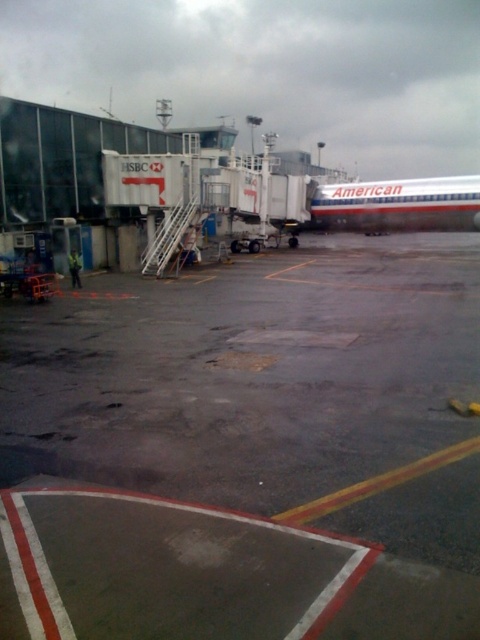
Question: Which point is closer to the camera?

Choices:
 (A) white metallic airplane at center
 (B) wet asphalt tarmac at center

Answer: (B)

Question: Is wet asphalt tarmac at center to the right of white metallic airplane at center from the viewer's perspective?

Choices:
 (A) yes
 (B) no

Answer: (B)

Question: Where is wet asphalt tarmac at center located in relation to white metallic airplane at center in the image?

Choices:
 (A) above
 (B) below

Answer: (B)

Question: Can you confirm if wet asphalt tarmac at center is positioned below white metallic airplane at center?

Choices:
 (A) yes
 (B) no

Answer: (A)